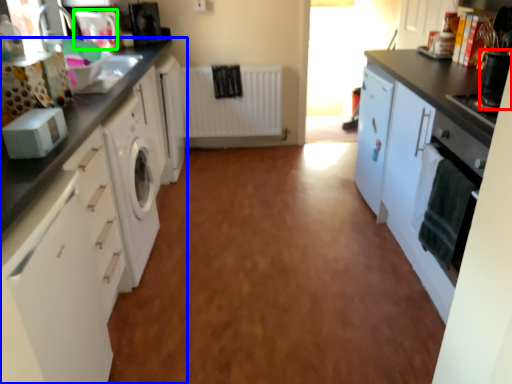
Question: Based on their relative distances, which object is farther from appliance (highlighted by a red box)? Choose from cabinetry (highlighted by a blue box) and appliance (highlighted by a green box).

Choices:
 (A) cabinetry
 (B) appliance

Answer: (B)